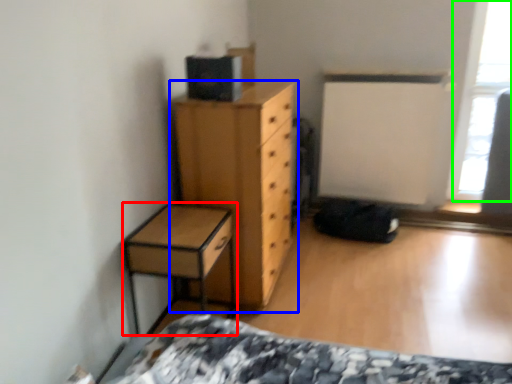
Question: Which object is the farthest from nightstand (highlighted by a red box)? Choose among these: chest of drawers (highlighted by a blue box) or window screen (highlighted by a green box).

Choices:
 (A) chest of drawers
 (B) window screen

Answer: (B)